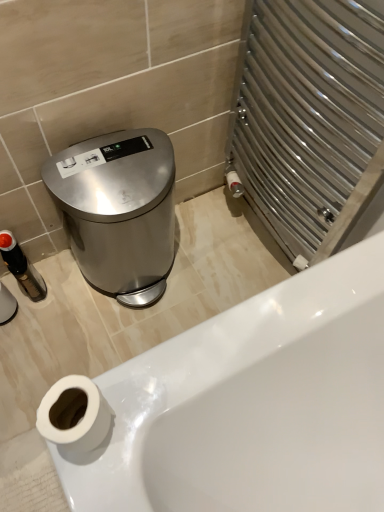
Question: Does white glossy bathtub at lower left come behind white matte toilet paper at lower left?

Choices:
 (A) no
 (B) yes

Answer: (B)

Question: Does white glossy bathtub at lower left appear on the right side of white matte toilet paper at lower left?

Choices:
 (A) no
 (B) yes

Answer: (B)

Question: Is white glossy bathtub at lower left looking in the opposite direction of white matte toilet paper at lower left?

Choices:
 (A) no
 (B) yes

Answer: (A)

Question: Considering the relative sizes of white glossy bathtub at lower left and white matte toilet paper at lower left in the image provided, is white glossy bathtub at lower left thinner than white matte toilet paper at lower left?

Choices:
 (A) no
 (B) yes

Answer: (A)

Question: From the image's perspective, would you say white glossy bathtub at lower left is positioned over white matte toilet paper at lower left?

Choices:
 (A) yes
 (B) no

Answer: (B)

Question: Is white glossy bathtub at lower left positioned before white matte toilet paper at lower left?

Choices:
 (A) no
 (B) yes

Answer: (A)

Question: Is white matte toilet paper at lower left oriented away from polished stainless steel trash can at left?

Choices:
 (A) no
 (B) yes

Answer: (A)

Question: Can you confirm if white matte toilet paper at lower left is thinner than polished stainless steel trash can at left?

Choices:
 (A) no
 (B) yes

Answer: (B)

Question: From a real-world perspective, is white matte toilet paper at lower left positioned under polished stainless steel trash can at left based on gravity?

Choices:
 (A) yes
 (B) no

Answer: (B)

Question: Is white matte toilet paper at lower left to the right of polished stainless steel trash can at left from the viewer's perspective?

Choices:
 (A) no
 (B) yes

Answer: (B)

Question: Considering the relative sizes of white matte toilet paper at lower left and polished stainless steel trash can at left in the image provided, is white matte toilet paper at lower left wider than polished stainless steel trash can at left?

Choices:
 (A) no
 (B) yes

Answer: (A)

Question: From a real-world perspective, is white matte toilet paper at lower left on top of polished stainless steel trash can at left?

Choices:
 (A) yes
 (B) no

Answer: (A)

Question: Is white matte toilet paper at lower left behind white glossy bathtub at lower left?

Choices:
 (A) no
 (B) yes

Answer: (A)